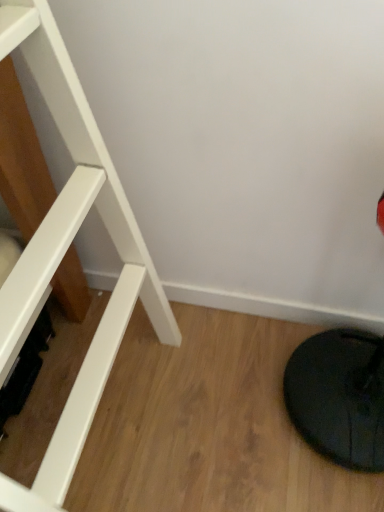
Locate an element on the screen. free space to the left of black leather swivel chair at lower right is located at coordinates (229, 404).